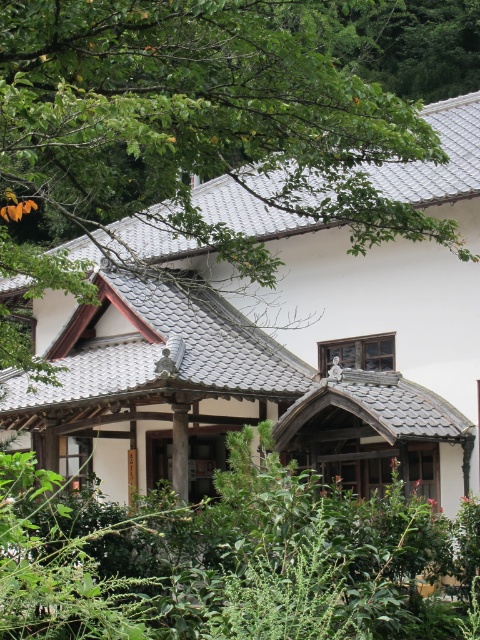
Measure the distance between point (286, 144) and camera.

Point (286, 144) is 28.09 meters from camera.

Between green leafy tree at upper left and green leafy bush at center, which one appears on the right side from the viewer's perspective?

Positioned to the right is green leafy bush at center.

Is point (90, 26) positioned behind point (376, 576)?

That is True.

The height and width of the screenshot is (640, 480). I want to click on green leafy tree at upper left, so click(200, 122).